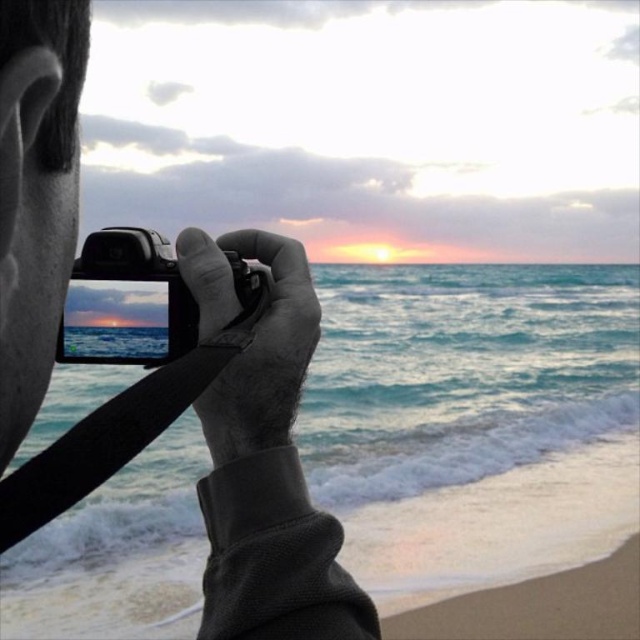
Question: Considering the real-world distances, which object is closest to the black plastic camera at center?

Choices:
 (A) sandy beach at lower right
 (B) matte black camera at center

Answer: (B)

Question: In this image, where is matte black camera at center located relative to black plastic camera at center?

Choices:
 (A) right
 (B) left

Answer: (A)

Question: Which object is the farthest from the black plastic camera at center?

Choices:
 (A) sandy beach at lower right
 (B) matte black camera at center

Answer: (A)

Question: Is matte black camera at center to the right of sandy beach at lower right from the viewer's perspective?

Choices:
 (A) yes
 (B) no

Answer: (B)

Question: Among these points, which one is farthest from the camera?

Choices:
 (A) [36, 536]
 (B) [273, 250]
 (C) [161, 266]

Answer: (A)

Question: Can you confirm if matte black camera at center is positioned to the left of sandy beach at lower right?

Choices:
 (A) yes
 (B) no

Answer: (A)